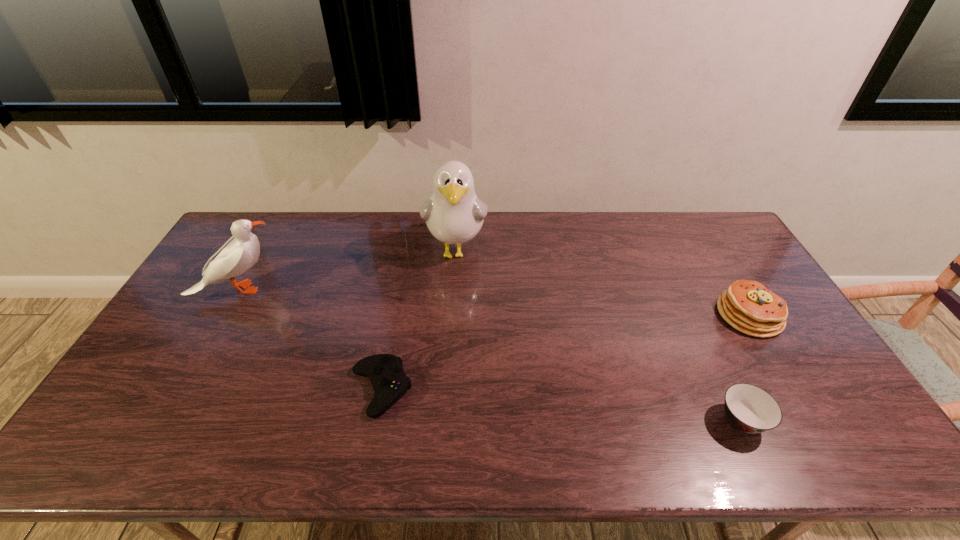
The width and height of the screenshot is (960, 540). Find the location of `vacant space that satisfies the following two spatial constraints: 1. at the beak of the leftmost object; 2. on the left side of the rightmost object`. vacant space that satisfies the following two spatial constraints: 1. at the beak of the leftmost object; 2. on the left side of the rightmost object is located at coordinates pos(224,315).

At what (x,y) coordinates should I click in order to perform the action: click on vacant position in the image that satisfies the following two spatial constraints: 1. at the beak of the fourth shortest object; 2. on the left side of the soup bowl. Please return your answer as a coordinate pair (x, y). The image size is (960, 540). Looking at the image, I should click on (164, 421).

Image resolution: width=960 pixels, height=540 pixels. I want to click on vacant area that satisfies the following two spatial constraints: 1. at the beak of the leftmost object; 2. on the left side of the rightmost object, so click(224, 315).